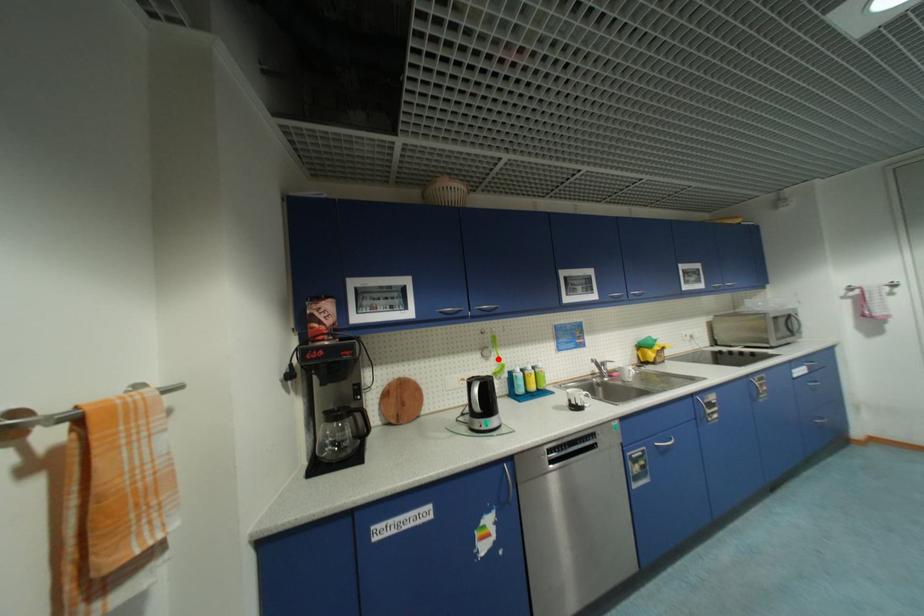
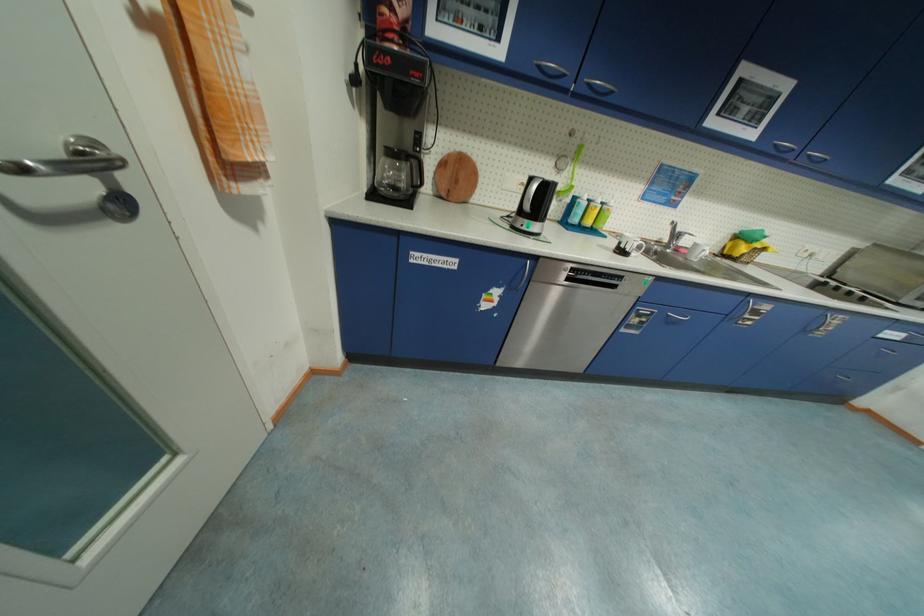
Question: I am providing you with two images of the same scene from different viewpoints. Image1 has a red point marked. In image2, the corresponding 3D location appears at what relative position? Reply with the corresponding letter.

Choices:
 (A) Closer
 (B) Farther

Answer: (A)